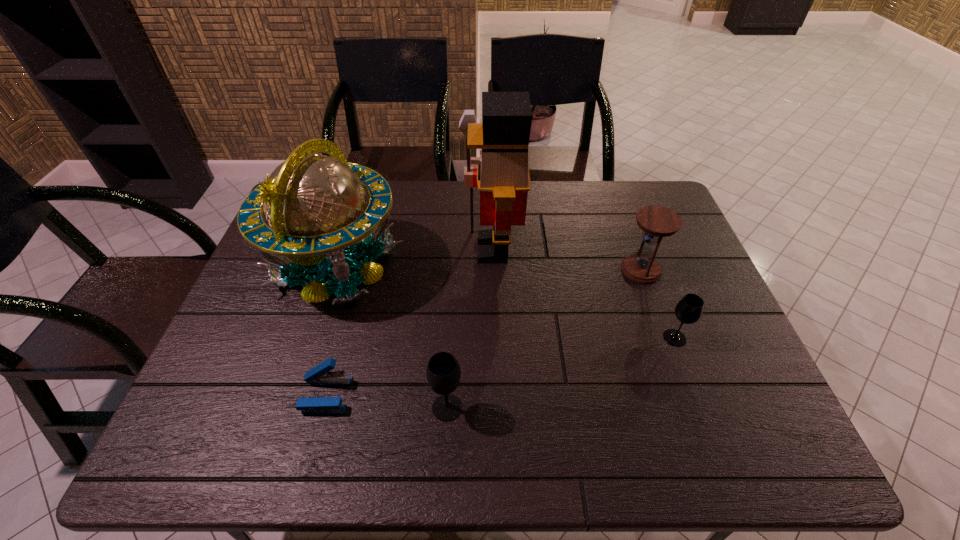
Find the location of a particular element. free region located in front of the tallest object holding the staff is located at coordinates (392, 249).

The width and height of the screenshot is (960, 540). In order to click on free region located 0.180m on the right of the globe in this screenshot , I will do `click(468, 266)`.

The height and width of the screenshot is (540, 960). In order to click on blank area located 0.140m on the back of the hourglass in this screenshot , I will do `click(625, 226)`.

Locate an element on the screen. This screenshot has height=540, width=960. vacant region located 0.200m on the right of the nearer wineglass is located at coordinates (555, 408).

Find the location of `free space located 0.100m on the back of the farther wineglass`. free space located 0.100m on the back of the farther wineglass is located at coordinates (660, 299).

Identify the location of vacant position located on the back of the shortest object. (342, 334).

The height and width of the screenshot is (540, 960). Identify the location of object that is positioned at the far edge. (316, 205).

Where is `object that is positioned at the near edge`? The image size is (960, 540). object that is positioned at the near edge is located at coordinates (443, 373).

I want to click on object that is positioned at the left edge, so click(x=316, y=205).

You are a GUI agent. You are given a task and a screenshot of the screen. Output one action in this format:
    pyautogui.click(x=<x>, y=<y>)
    Task: Click on the hourglass that is at the right edge
    Image resolution: width=960 pixels, height=540 pixels.
    Given the screenshot: What is the action you would take?
    pyautogui.click(x=657, y=222)